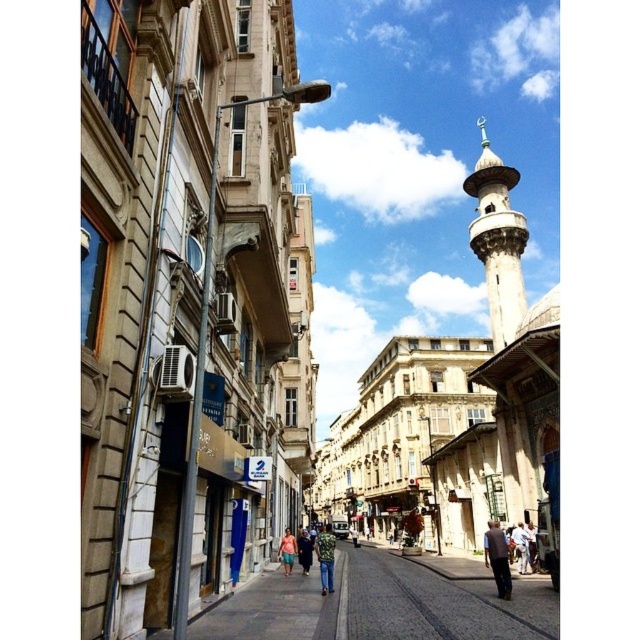
Can you confirm if denim pants at center is positioned below pink fabric dress at center?

Correct, denim pants at center is located below pink fabric dress at center.

Who is higher up, denim pants at center or pink fabric dress at center?

Positioned higher is pink fabric dress at center.

Identify the location of denim pants at center. The image size is (640, 640). (324, 557).

Locate an element on the screen. This screenshot has height=640, width=640. denim pants at center is located at coordinates (324, 557).

Which of these two, dark brown leather jacket at center or light blue jeans at center, stands shorter?

light blue jeans at center is shorter.

Can you confirm if dark brown leather jacket at center is positioned below light blue jeans at center?

Yes, dark brown leather jacket at center is below light blue jeans at center.

Is point (490, 532) farther from viewer compared to point (518, 528)?

No, it is not.

Locate an element on the screen. This screenshot has height=640, width=640. dark brown leather jacket at center is located at coordinates (497, 557).

Which is more to the right, dark brown leather jacket at center or denim pants at center?

dark brown leather jacket at center

Is dark brown leather jacket at center behind denim pants at center?

No, dark brown leather jacket at center is in front of denim pants at center.

Is point (490, 561) farther from viewer compared to point (326, 525)?

No, it is in front of (326, 525).

This screenshot has height=640, width=640. In order to click on dark brown leather jacket at center in this screenshot , I will do `click(497, 557)`.